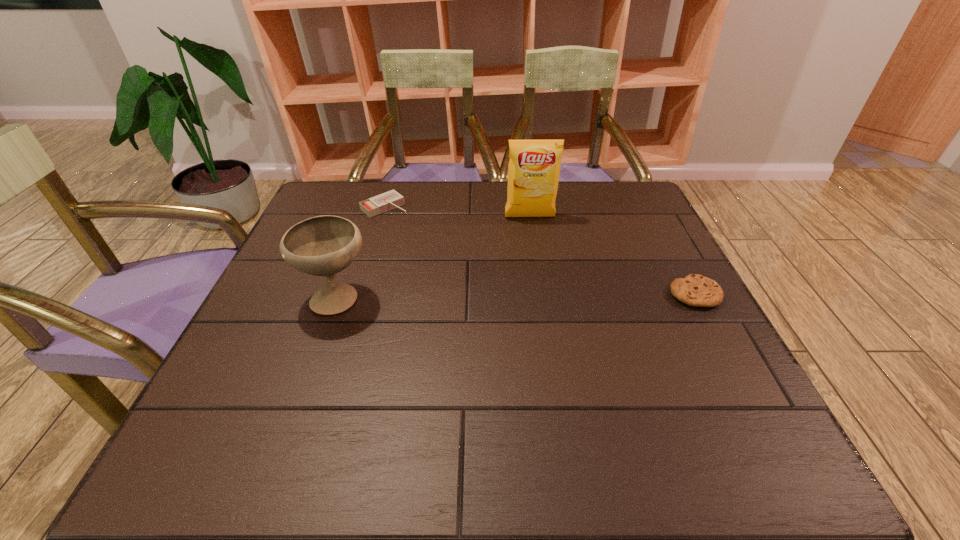
The height and width of the screenshot is (540, 960). I want to click on free location at the near edge of the desktop, so click(601, 385).

You are a GUI agent. You are given a task and a screenshot of the screen. Output one action in this format:
    pyautogui.click(x=<x>, y=<y>)
    Task: Click on the vacant space at the left edge of the desktop
    This screenshot has height=540, width=960.
    Given the screenshot: What is the action you would take?
    pyautogui.click(x=260, y=325)

At what (x,y) coordinates should I click in order to perform the action: click on vacant area at the right edge of the desktop. Please return your answer as a coordinate pair (x, y). Looking at the image, I should click on (673, 249).

Find the location of a particular element. vacant space at the far left corner of the desktop is located at coordinates [321, 194].

What are the coordinates of `vacant area at the near left corner of the desktop` in the screenshot? It's located at (242, 381).

Where is `vacant area at the far right corner`? Image resolution: width=960 pixels, height=540 pixels. vacant area at the far right corner is located at coordinates (611, 206).

Where is `free space at the near right corner`? The width and height of the screenshot is (960, 540). free space at the near right corner is located at coordinates (714, 377).

Locate an element on the screen. blank region between the chalice and the tallest object is located at coordinates (434, 257).

Locate an element on the screen. This screenshot has width=960, height=540. free spot between the rightmost object and the matchbox is located at coordinates (540, 251).

Locate an element on the screen. empty location between the second object from right to left and the matchbox is located at coordinates (457, 212).